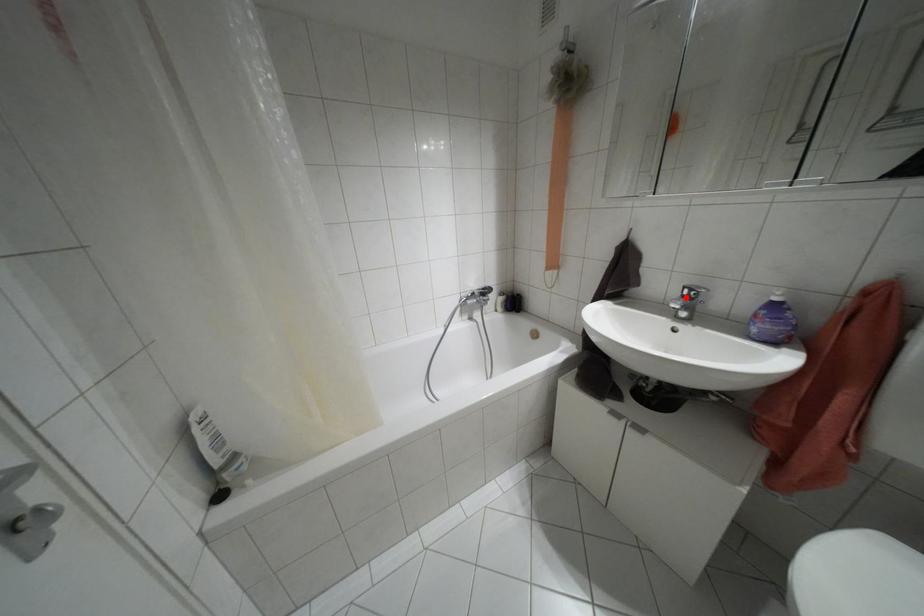
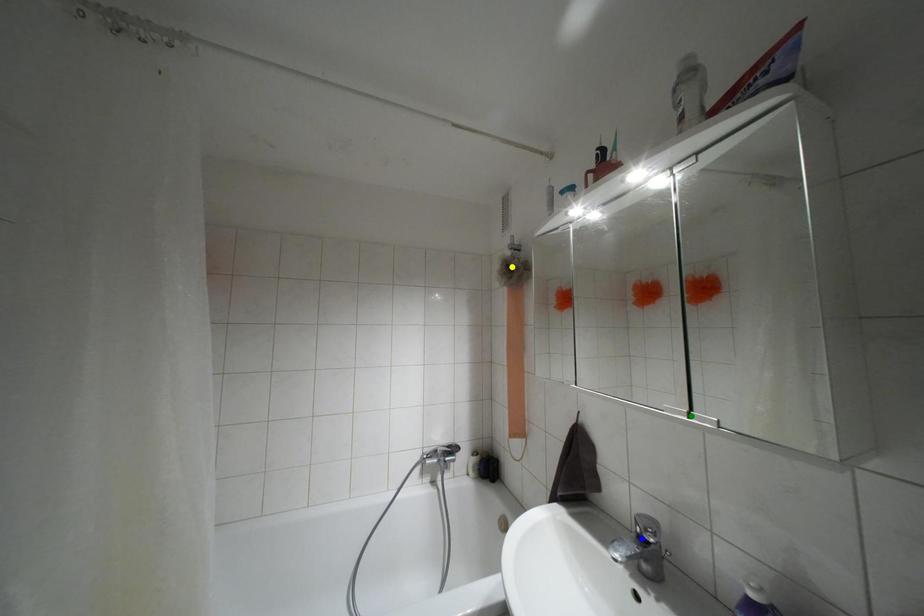
Question: I am providing you with two images of the same scene from different viewpoints. A red point is marked on the first image. You are given multiple points on the second image. Which spot in image 2 lines up with the point in image 1?

Choices:
 (A) green point
 (B) blue point
 (C) yellow point

Answer: (B)